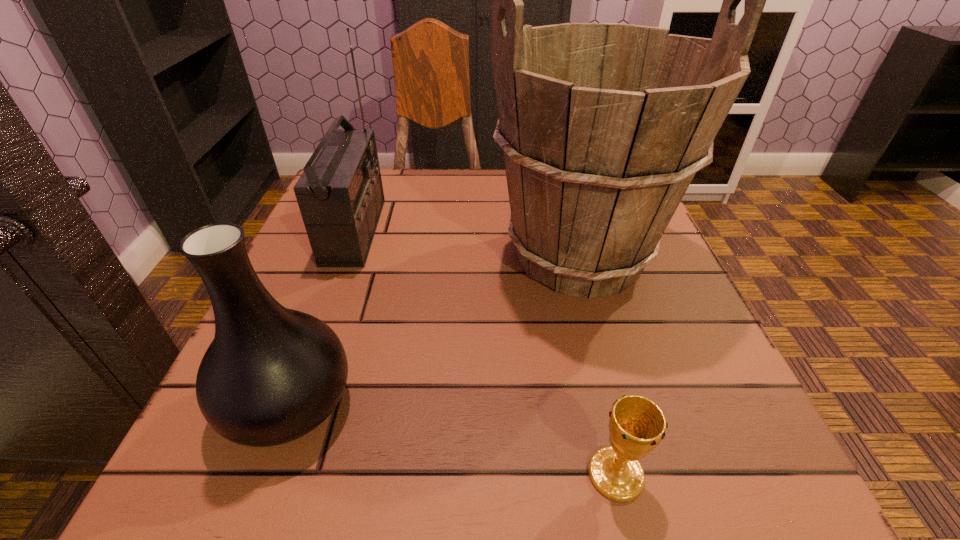
You are a GUI agent. You are given a task and a screenshot of the screen. Output one action in this format:
    pyautogui.click(x=<x>, y=<y>)
    Task: Click on the tallest object
    
    Given the screenshot: What is the action you would take?
    pyautogui.click(x=603, y=126)

I want to click on radio receiver, so click(340, 195).

The width and height of the screenshot is (960, 540). What are the coordinates of `the third tallest object` in the screenshot? It's located at (271, 375).

Where is `the shortest object`? the shortest object is located at coordinates (637, 425).

Where is `vacant space located on the left of the tallest object`? This screenshot has width=960, height=540. vacant space located on the left of the tallest object is located at coordinates (396, 256).

This screenshot has width=960, height=540. In order to click on vacant point located 0.280m on the front panel of the radio receiver in this screenshot , I will do `click(510, 231)`.

You are a GUI agent. You are given a task and a screenshot of the screen. Output one action in this format:
    pyautogui.click(x=<x>, y=<y>)
    Task: Click on the vacant space located on the right of the third tallest object
    
    Given the screenshot: What is the action you would take?
    pyautogui.click(x=432, y=402)

Where is `free space located 0.370m on the left of the chalice`? free space located 0.370m on the left of the chalice is located at coordinates (288, 474).

What are the coordinates of `bucket located in the far edge section of the desktop` in the screenshot? It's located at (603, 126).

Find the location of a particular element. The width and height of the screenshot is (960, 540). radio receiver located at the far edge is located at coordinates (340, 195).